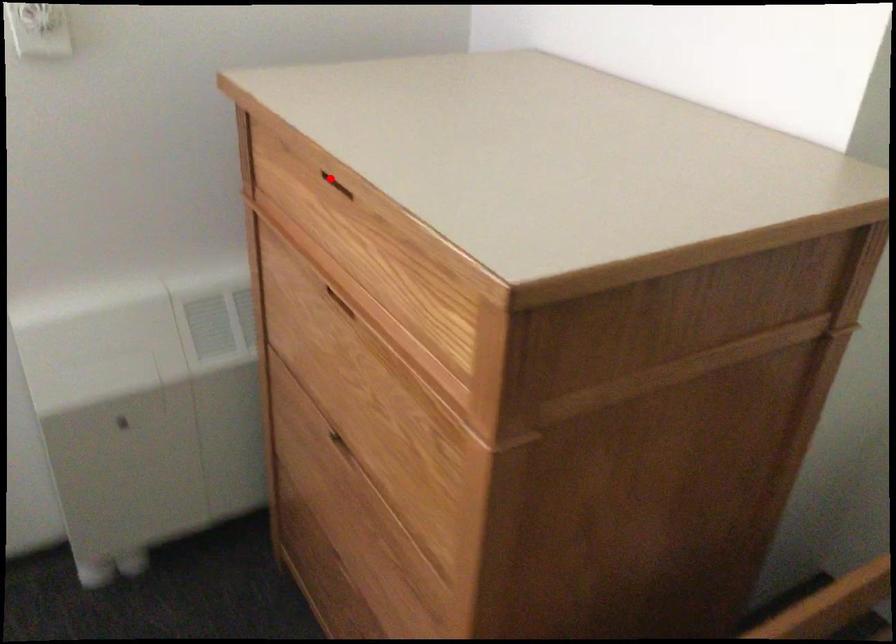
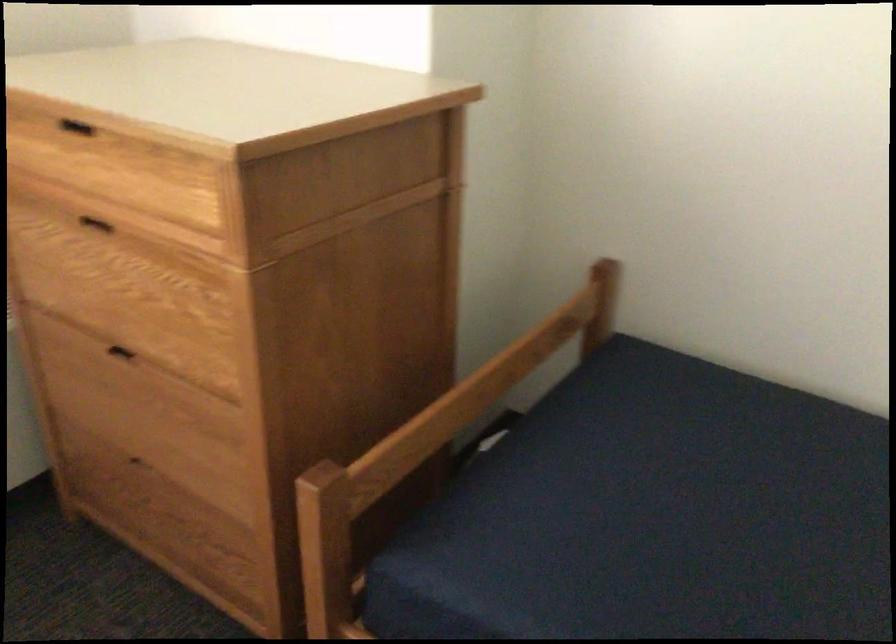
Where in the second image is the point corresponding to the highlighted location from the first image?

(75, 127)